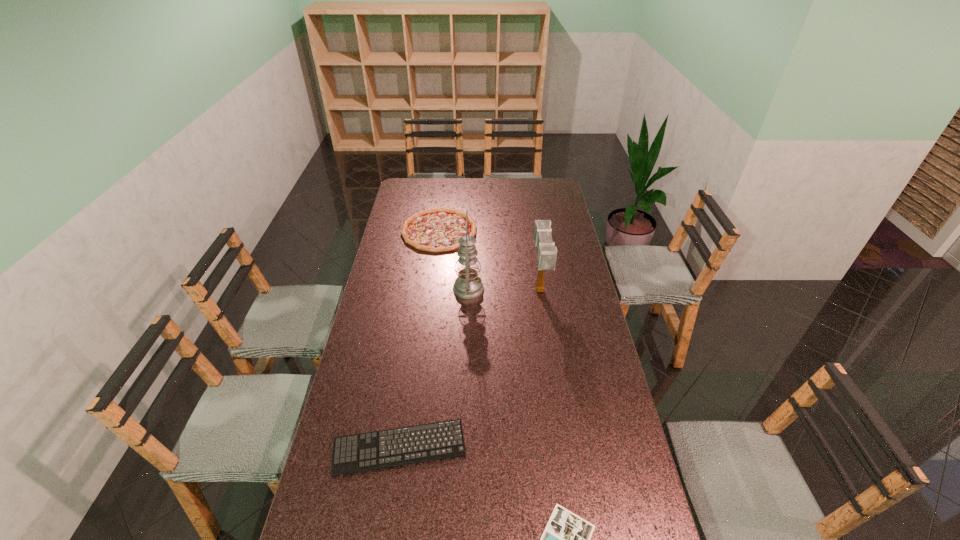
Locate an element on the screen. This screenshot has width=960, height=540. the tallest object is located at coordinates (468, 285).

The image size is (960, 540). Identify the location of mallet. (547, 253).

This screenshot has height=540, width=960. I want to click on the third shortest object, so click(x=438, y=229).

Where is `the farthest object`? The height and width of the screenshot is (540, 960). the farthest object is located at coordinates (438, 229).

Where is `computer keyboard`? The height and width of the screenshot is (540, 960). computer keyboard is located at coordinates (377, 441).

The width and height of the screenshot is (960, 540). What are the coordinates of `the fourth tallest object` in the screenshot? It's located at (377, 441).

Find the location of a particular element. This screenshot has height=540, width=960. vacant space located 0.250m on the back of the oil lamp is located at coordinates (469, 242).

Where is `vacant area situated 0.090m on the back of the second tallest object`? vacant area situated 0.090m on the back of the second tallest object is located at coordinates (535, 262).

The height and width of the screenshot is (540, 960). I want to click on vacant region located 0.120m on the front of the pizza, so click(x=434, y=270).

Find the location of a particular element. The height and width of the screenshot is (540, 960). vacant region located on the right of the computer keyboard is located at coordinates (483, 448).